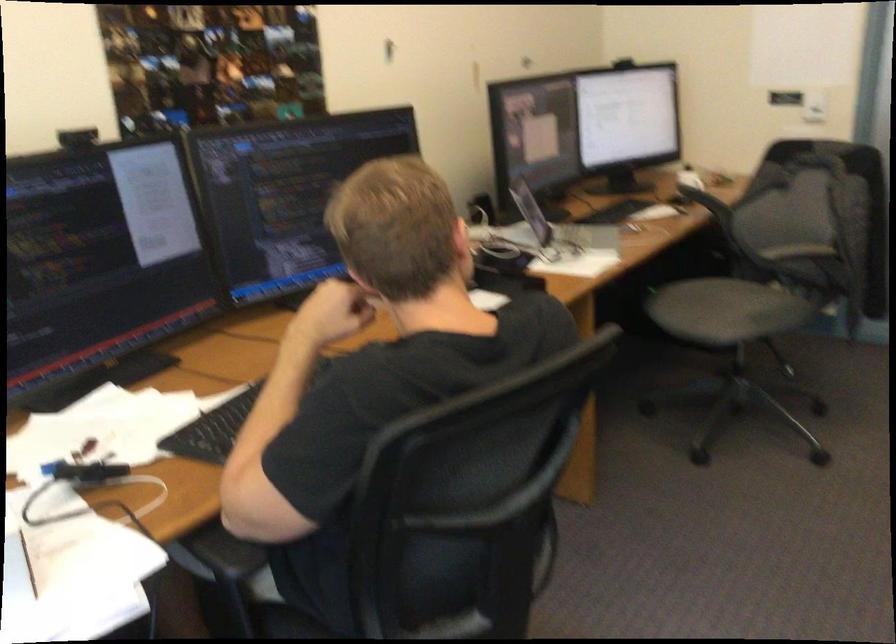
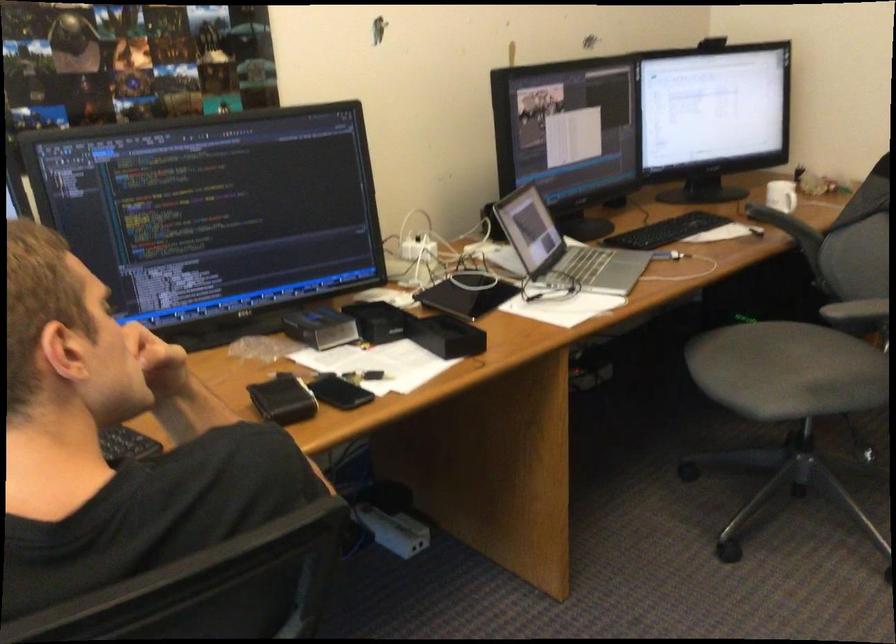
In a continuous first-person perspective shot, in which direction is the camera moving?

The cameraman moved toward right, forward.